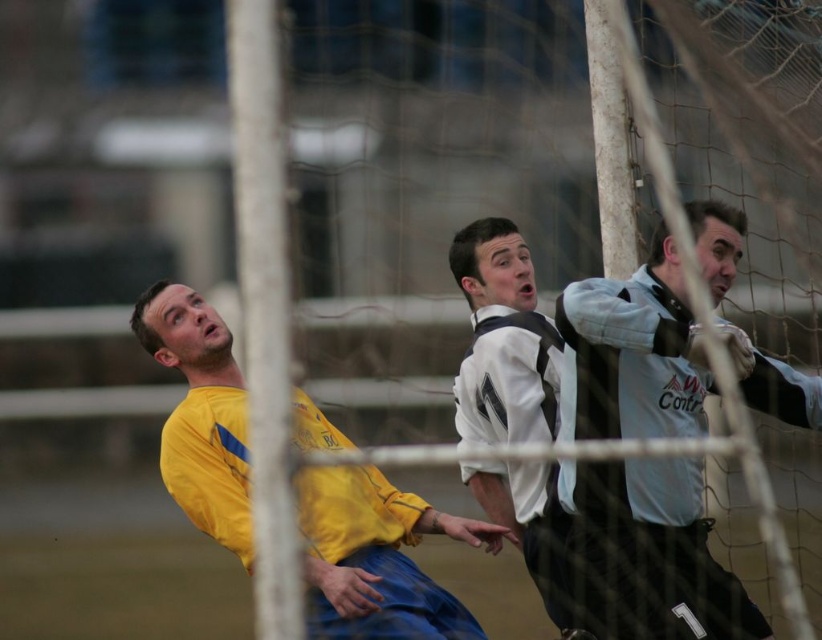
Is white mesh net at center to the right of yellow jersey at left from the viewer's perspective?

Indeed, white mesh net at center is positioned on the right side of yellow jersey at left.

Which is below, white mesh net at center or yellow jersey at left?

yellow jersey at left is below.

Locate an element on the screen. The width and height of the screenshot is (822, 640). white mesh net at center is located at coordinates pyautogui.click(x=675, y=388).

Between white jersey at center and yellow jersey at left, which one appears on the right side from the viewer's perspective?

white jersey at center

Who is more forward, (627, 563) or (433, 604)?

Point (627, 563) is in front.

Where is `white jersey at center`? white jersey at center is located at coordinates (656, 548).

Between point (414, 529) and point (520, 300), which one is positioned in front?

Point (414, 529) is in front.

Is yellow jersey at left below white matte jersey at center?

Indeed, yellow jersey at left is positioned under white matte jersey at center.

Is point (366, 584) positioned before point (486, 358)?

Yes.

Locate an element on the screen. yellow jersey at left is located at coordinates (377, 557).